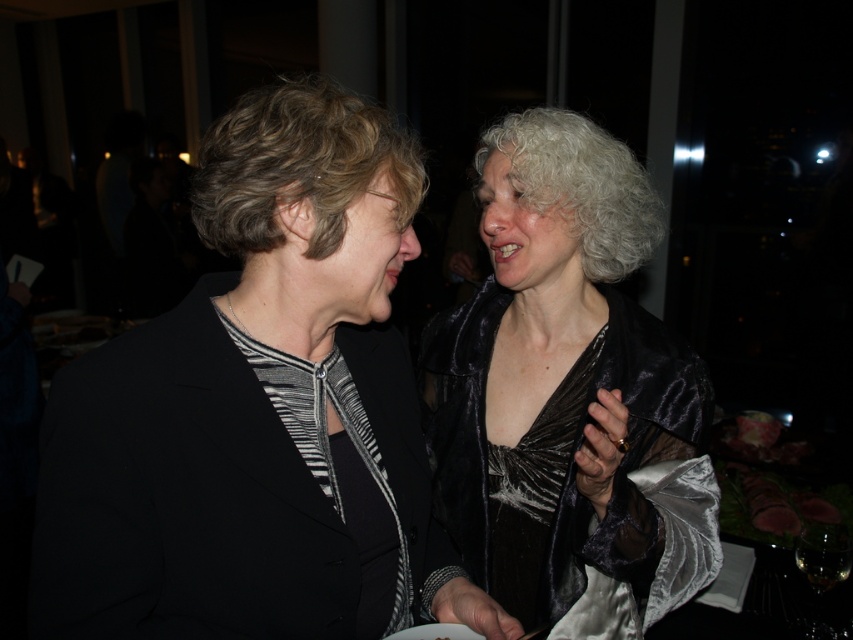
Question: Which object appears farthest from the camera in this image?

Choices:
 (A) matte black blazer at left
 (B) satin black dress at right

Answer: (B)

Question: Which of the following is the farthest from the observer?

Choices:
 (A) matte black blazer at left
 (B) satin black dress at right

Answer: (B)

Question: Can you confirm if matte black blazer at left is wider than satin black dress at right?

Choices:
 (A) yes
 (B) no

Answer: (A)

Question: Is matte black blazer at left positioned before satin black dress at right?

Choices:
 (A) no
 (B) yes

Answer: (B)

Question: Does matte black blazer at left have a larger size compared to satin black dress at right?

Choices:
 (A) yes
 (B) no

Answer: (B)

Question: Which point is closer to the camera?

Choices:
 (A) satin black dress at right
 (B) matte black blazer at left

Answer: (B)